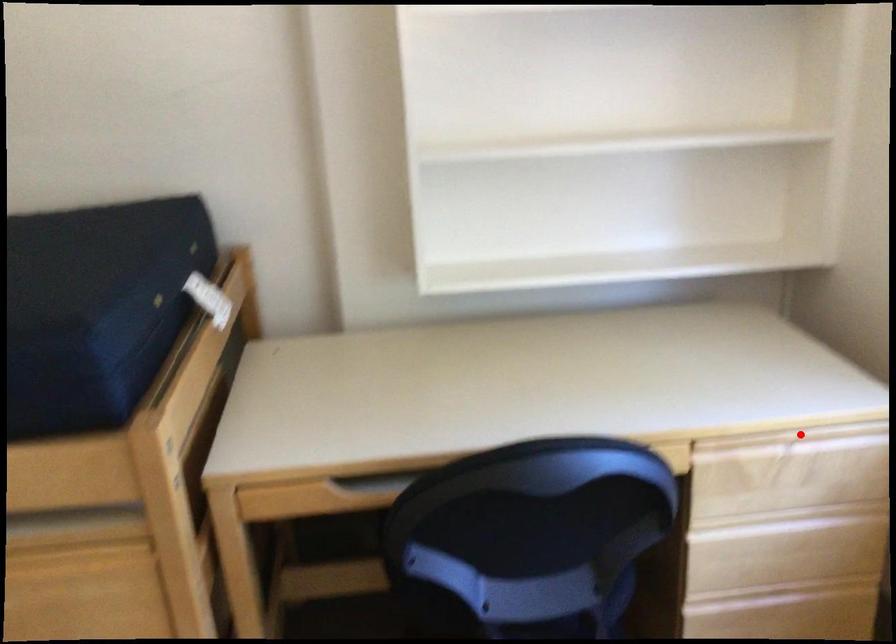
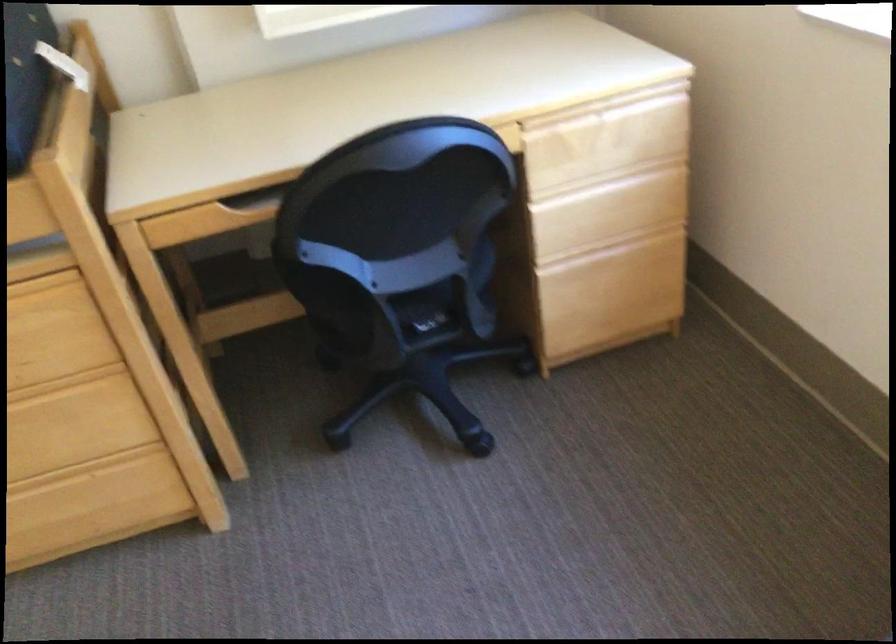
Find the pixel in the second image that matches the highlighted location in the first image.

(607, 106)